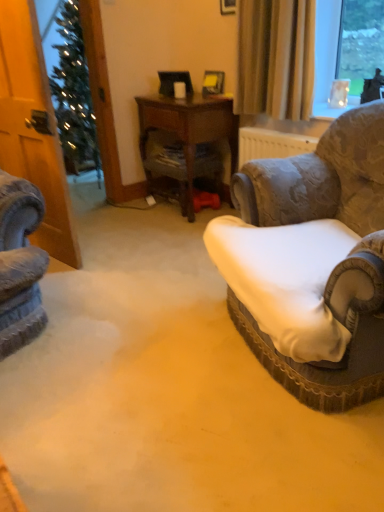
Where is `vacant point above white fabric cushion at right (from a real-world perspective)`? vacant point above white fabric cushion at right (from a real-world perspective) is located at coordinates (135, 301).